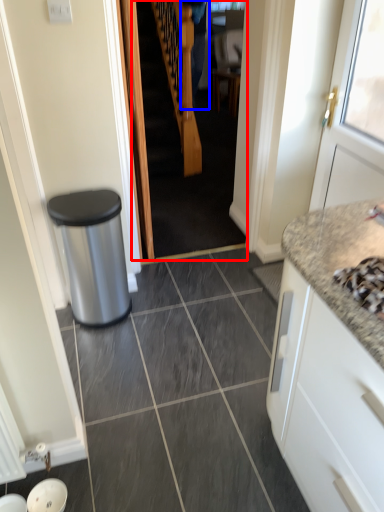
Question: Which object is further to the camera taking this photo, stairwell (highlighted by a red box) or couple (highlighted by a blue box)?

Choices:
 (A) stairwell
 (B) couple

Answer: (B)